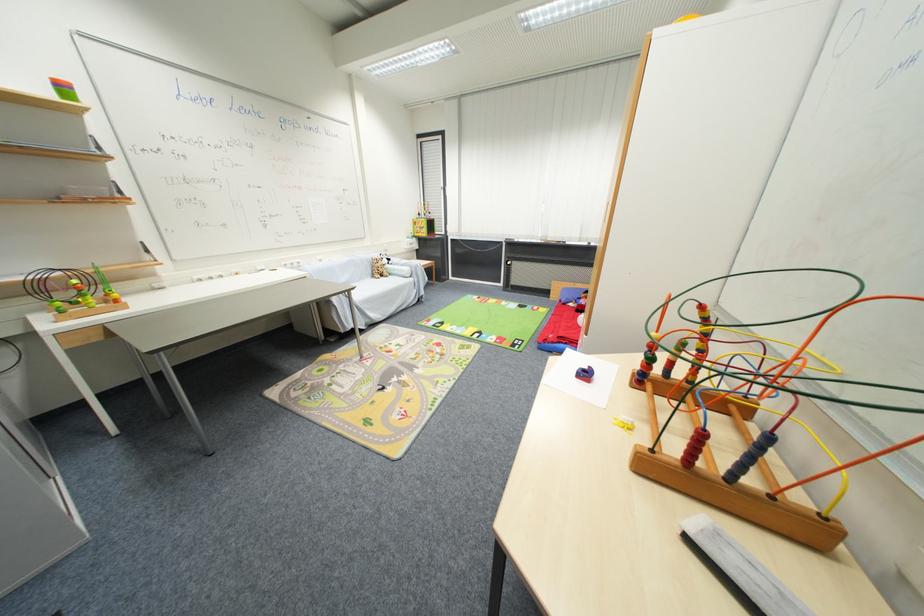
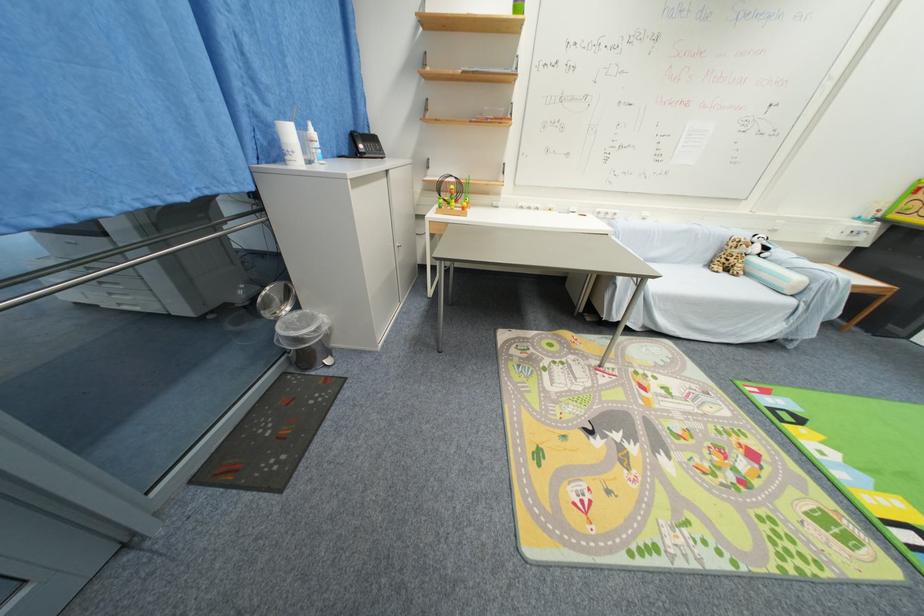
Locate, in the second image, the point that corresponds to pixel 379 277 in the first image.

(714, 265)